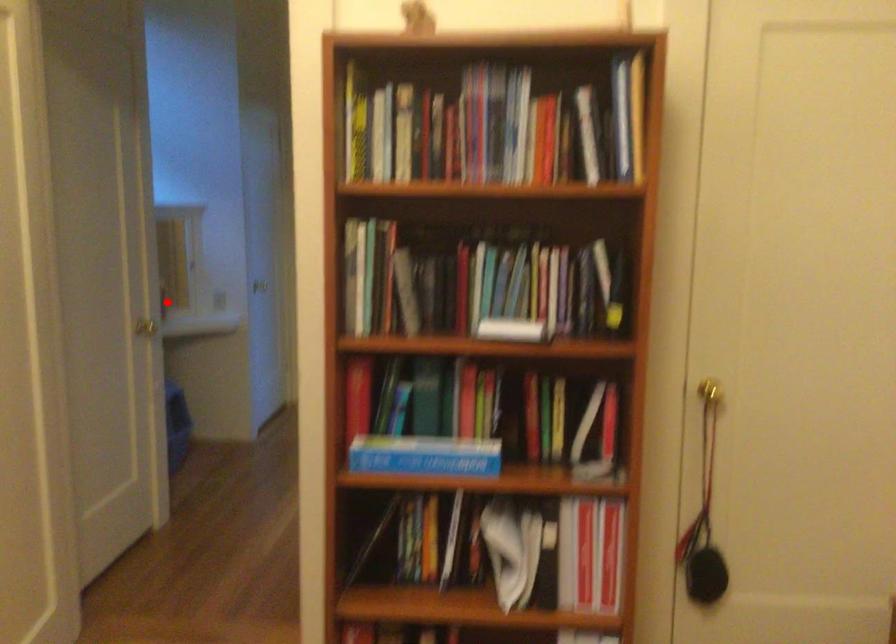
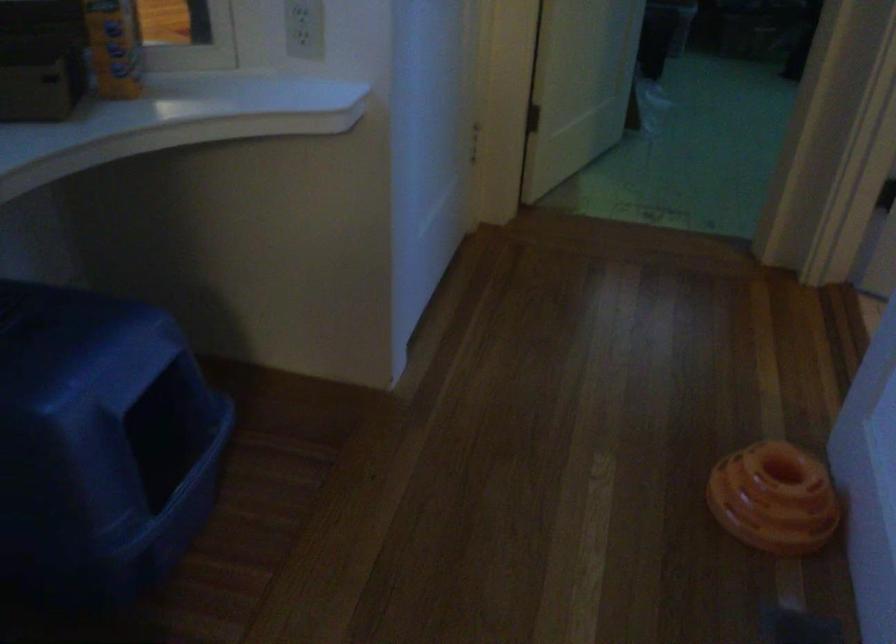
In the second image, find the point that corresponds to the highlighted location in the first image.

(114, 46)